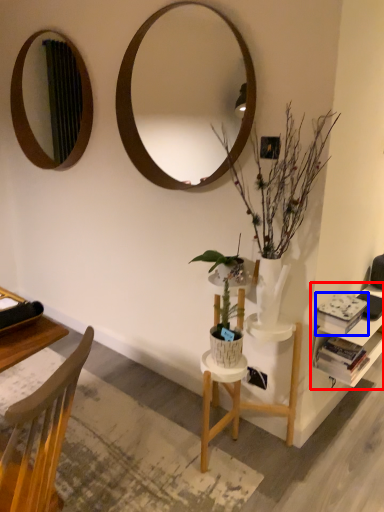
Question: Which object appears farthest to the camera in this image, shelf (highlighted by a red box) or book (highlighted by a blue box)?

Choices:
 (A) shelf
 (B) book

Answer: (A)